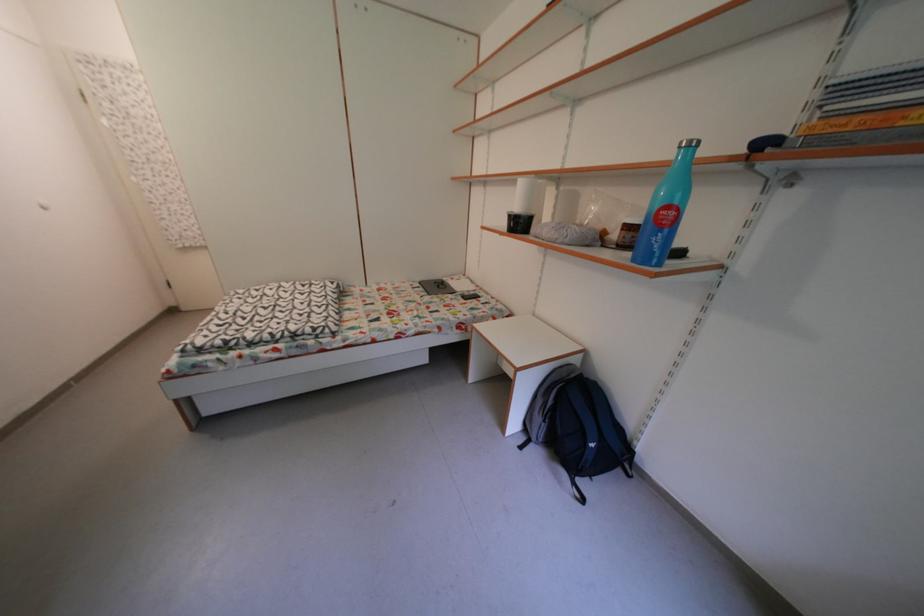
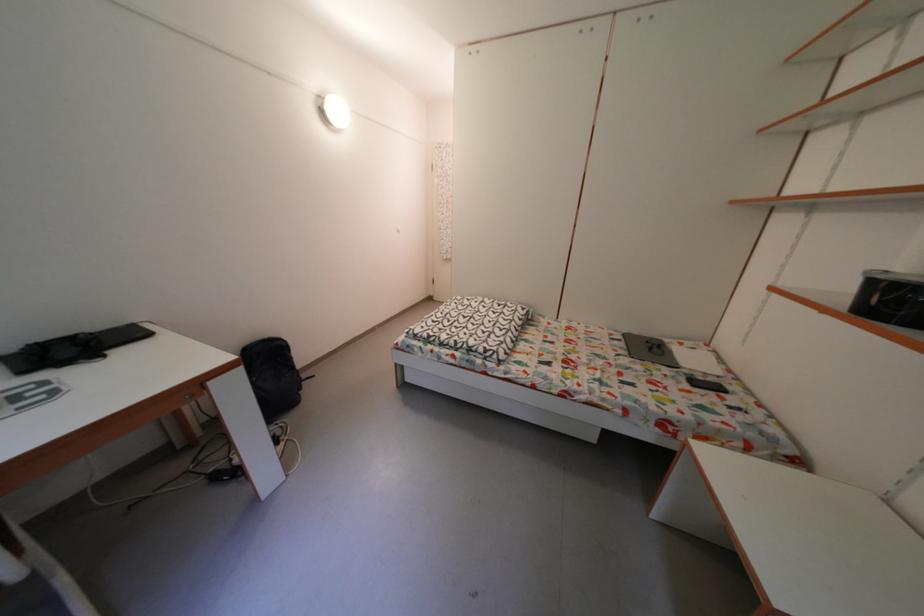
Find the pixel in the second image that matches point 481,299 in the first image.

(721, 385)